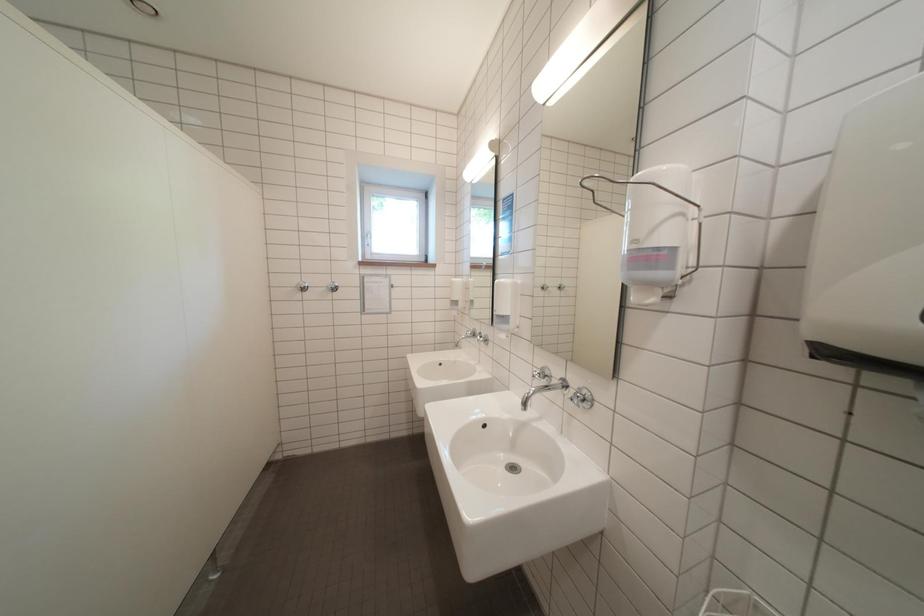
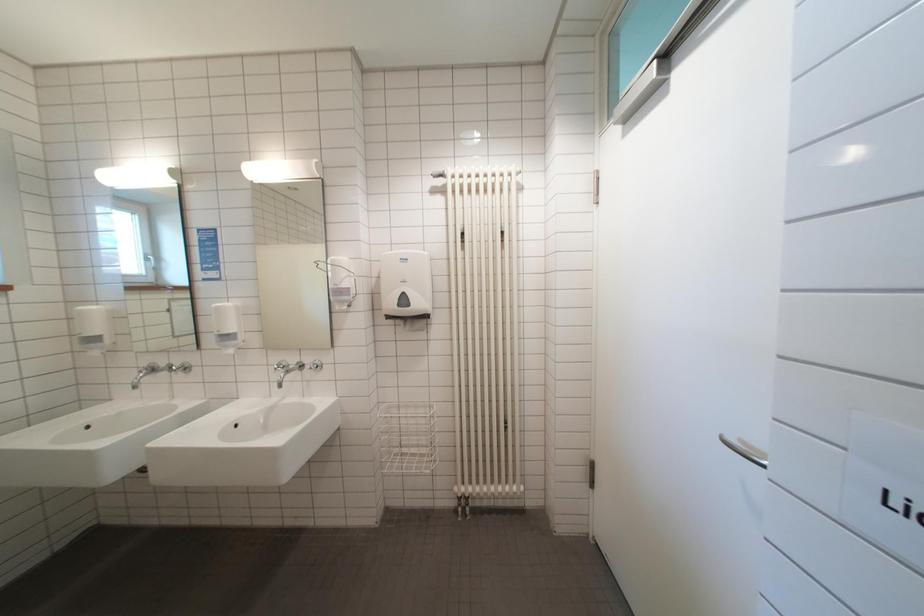
Question: Based on the continuous images, in which direction is the camera rotating? Reply with the corresponding letter.

Choices:
 (A) Left
 (B) Right
 (C) Up
 (D) Down

Answer: (B)